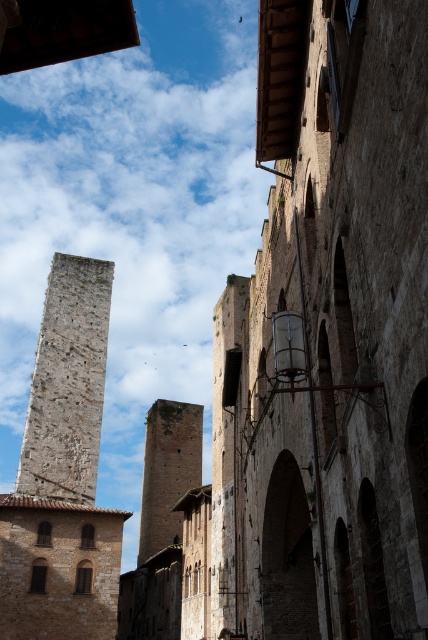
Can you confirm if rough stone tower at left is positioned below brown stone tower at center?

No, rough stone tower at left is not below brown stone tower at center.

Can you confirm if rough stone tower at left is positioned to the left of brown stone tower at center?

Yes, rough stone tower at left is to the left of brown stone tower at center.

The height and width of the screenshot is (640, 428). What do you see at coordinates (68, 381) in the screenshot? I see `rough stone tower at left` at bounding box center [68, 381].

Locate an element on the screen. The image size is (428, 640). rough stone tower at left is located at coordinates (68, 381).